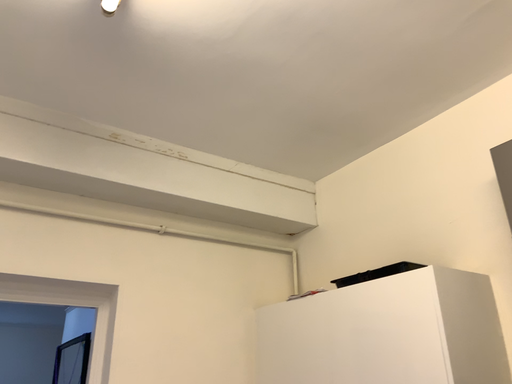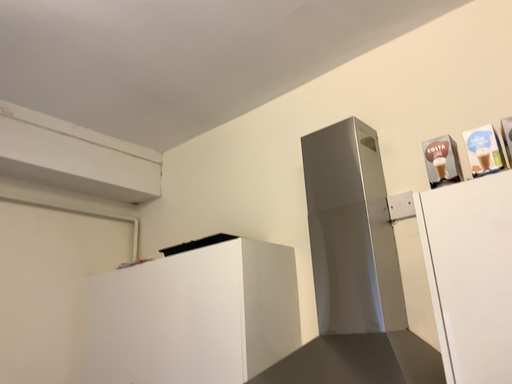
Question: Which way did the camera rotate in the video?

Choices:
 (A) rotated left
 (B) rotated right

Answer: (B)